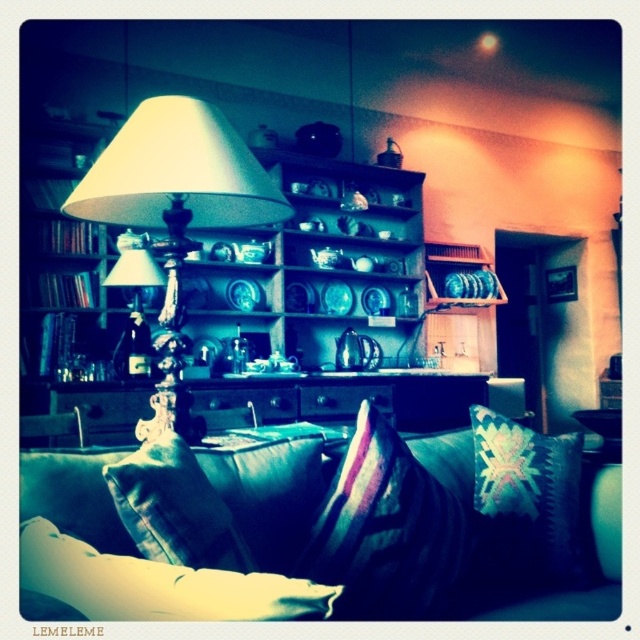
Question: Does velvet striped pillow at center come behind matte glass lampshade at center?

Choices:
 (A) no
 (B) yes

Answer: (A)

Question: Which of these objects is positioned farthest from the velvet striped pillow at center?

Choices:
 (A) velvet green armchair at lower left
 (B) velvet cushion at lower left

Answer: (A)

Question: Is velvet striped pillow at center smaller than velvet cushion at lower left?

Choices:
 (A) no
 (B) yes

Answer: (A)

Question: Among these objects, which one is farthest from the camera?

Choices:
 (A) velvet cushion at lower left
 (B) velvet striped pillow at center

Answer: (B)

Question: Estimate the real-world distances between objects in this image. Which object is closer to the velvet teal couch at lower center?

Choices:
 (A) velvet green pillow at lower center
 (B) velvet striped pillow at center

Answer: (B)

Question: Considering the relative positions of velvet cushion at lower left and velvet green armchair at lower left in the image provided, where is velvet cushion at lower left located with respect to velvet green armchair at lower left?

Choices:
 (A) right
 (B) left

Answer: (A)